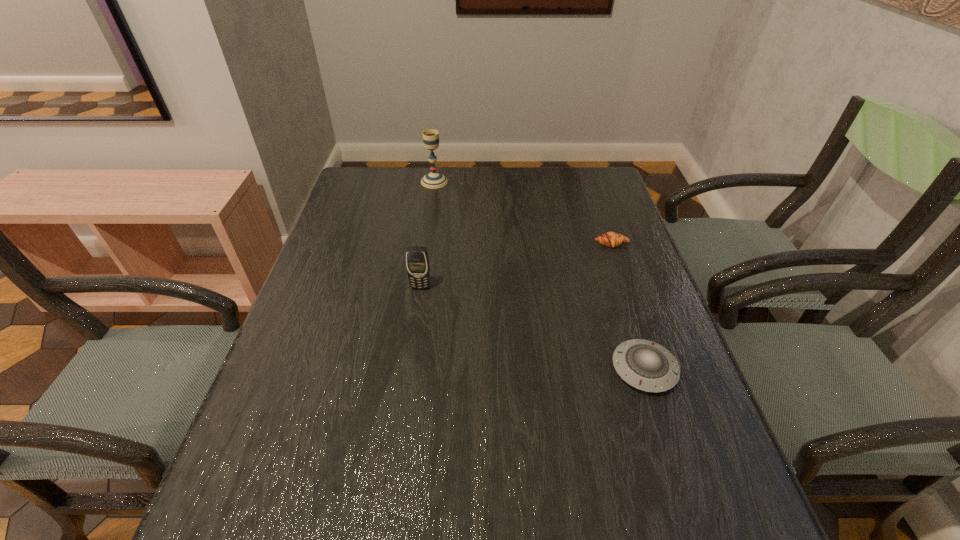
Locate an element on the screen. object present at the far edge is located at coordinates (433, 180).

The width and height of the screenshot is (960, 540). Find the location of `saucer located at the right edge`. saucer located at the right edge is located at coordinates (645, 365).

Locate an element on the screen. The image size is (960, 540). pastry located in the right edge section of the desktop is located at coordinates (610, 239).

The height and width of the screenshot is (540, 960). I want to click on vacant position at the far edge of the desktop, so click(489, 193).

Find the location of a particular element. This screenshot has width=960, height=540. free space at the near edge of the desktop is located at coordinates (354, 514).

Image resolution: width=960 pixels, height=540 pixels. Identify the location of free space at the left edge. (307, 410).

This screenshot has width=960, height=540. In order to click on vacant area at the right edge of the desktop in this screenshot , I will do `click(573, 211)`.

Image resolution: width=960 pixels, height=540 pixels. Find the location of `vacant region at the far left corner`. vacant region at the far left corner is located at coordinates point(349,192).

The width and height of the screenshot is (960, 540). What are the coordinates of `vacant space at the far right corner of the desktop` in the screenshot? It's located at (582, 176).

The image size is (960, 540). I want to click on vacant area that lies between the second tallest object and the second farthest object, so click(516, 266).